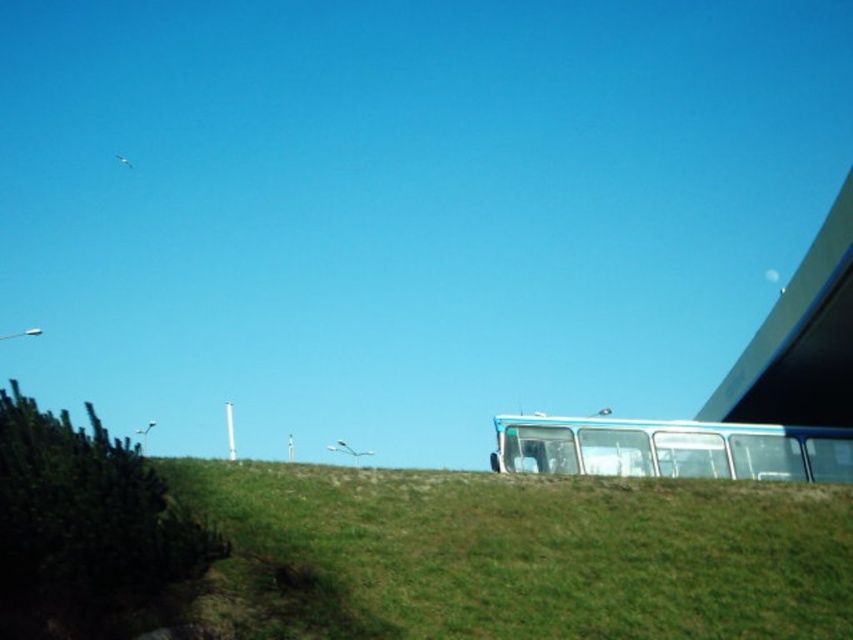
You are standing on the green grassy hillside at center and want to see the top of the blue metallic bus at right. Considering their heights, do you think you can see the top of the bus from your current position?

The green grassy hillside at center has a lesser height compared to blue metallic bus at right, so yes, you can see the top of the blue metallic bus at right from your position because the bus is taller than the hillside.

You are standing at the center of the image and want to locate the blue metallic bus at right. According to the coordinates provided, in which direction should you look to find it?

The blue metallic bus at right is located at coordinates point (670,449), which means it is positioned to the right and slightly above the center of the image. Therefore, you should look to your right and slightly upwards to locate it.

You are a delivery drone with a maximum flight range of 30 meters. You need to fly from the blue metallic bus at right to the smooth concrete overpass at upper right. Can you reach it without needing a recharge?

The distance between the blue metallic bus at right and the smooth concrete overpass at upper right is 33.78 meters, which exceeds the drone s 30 meter range. Therefore, the drone cannot reach the overpass without recharging.